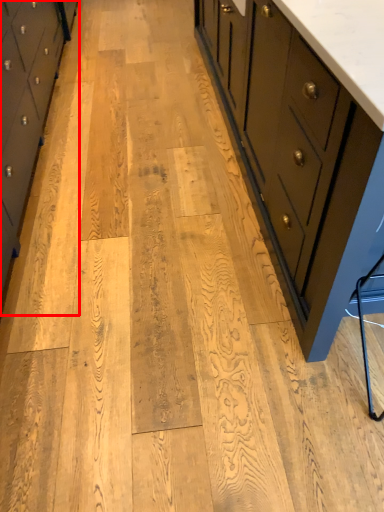
Question: In this image, where is chest of drawers (annotated by the red box) located relative to chest of drawers?

Choices:
 (A) right
 (B) left

Answer: (B)